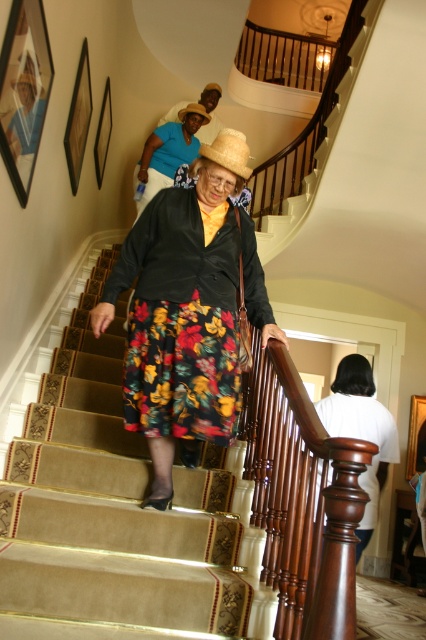
Question: Estimate the real-world distances between objects in this image. Which object is closer to the strawhat at center?

Choices:
 (A) floral skirt at center
 (B) white fabric at upper center
 (C) strawmaterial/texturehat at upper center
 (D) carpeted stairs at center

Answer: (C)

Question: Is carpeted stairs at center above white fabric at upper center?

Choices:
 (A) yes
 (B) no

Answer: (A)

Question: Does floral skirt at center appear over strawmaterial/texturehat at upper center?

Choices:
 (A) yes
 (B) no

Answer: (B)

Question: Among these points, which one is nearest to the camera?

Choices:
 (A) (x=213, y=257)
 (B) (x=233, y=141)

Answer: (B)

Question: Considering the real-world distances, which object is farthest from the floral skirt at center?

Choices:
 (A) strawmaterial/texturehat at upper center
 (B) carpeted stairs at center
 (C) matte black hat at upper center

Answer: (C)

Question: Does white fabric at upper center come behind strawmaterial/texturehat at upper center?

Choices:
 (A) no
 (B) yes

Answer: (B)